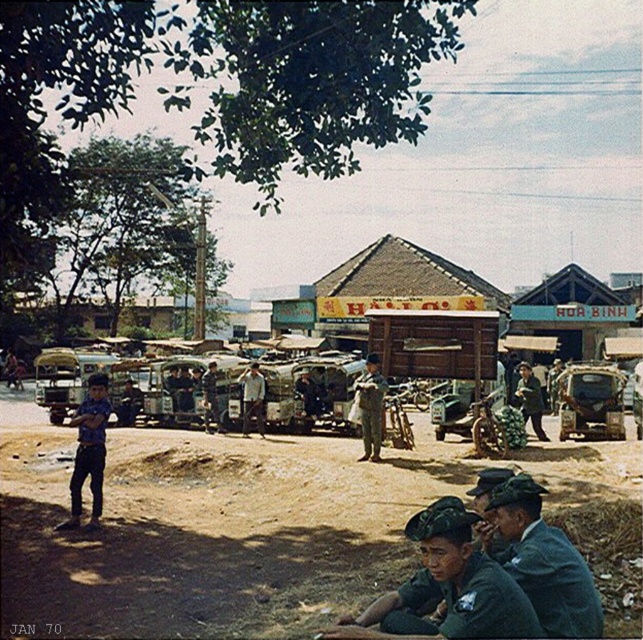
You are a photographer standing in the middle of the street. You want to take a photo that includes both point (617, 410) and point (514, 390). Which point will appear larger in the photo?

Point (617, 410) is closer to the camera than point (514, 390), so it will appear larger in the photo.

What is the 2D coordinate of the brown sandy dirt field at center?

The brown sandy dirt field at center is located at the 2D coordinate point of (210, 529).